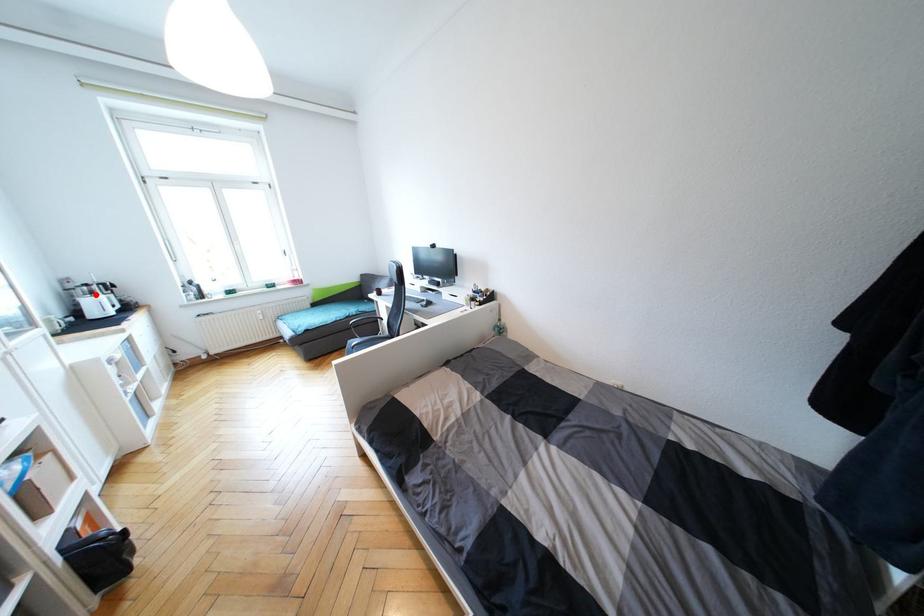
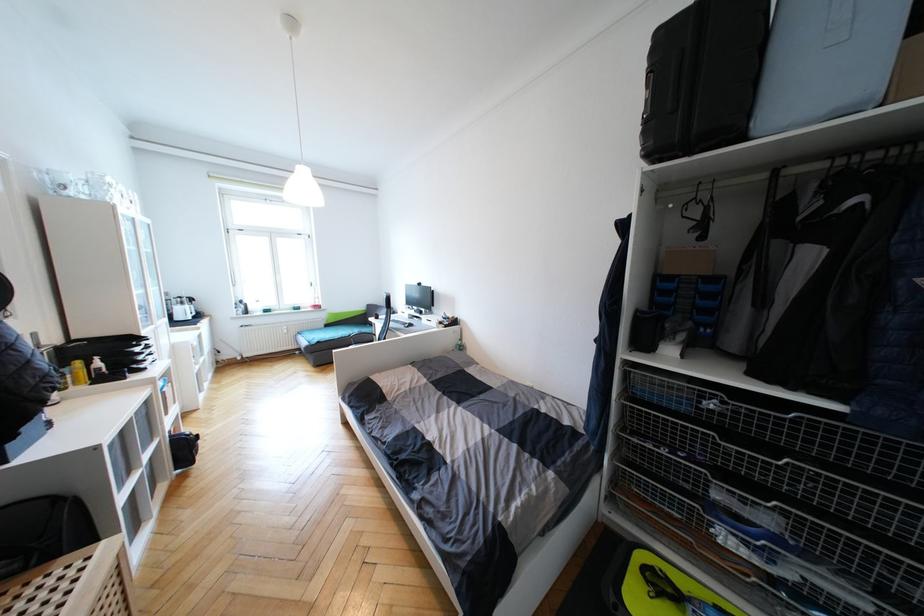
Question: A red point is marked in image1. In image2, is the corresponding 3D point closer to the camera or farther? Reply with the corresponding letter.

Choices:
 (A) The corresponding 3D point is closer.
 (B) The corresponding 3D point is farther.

Answer: (A)